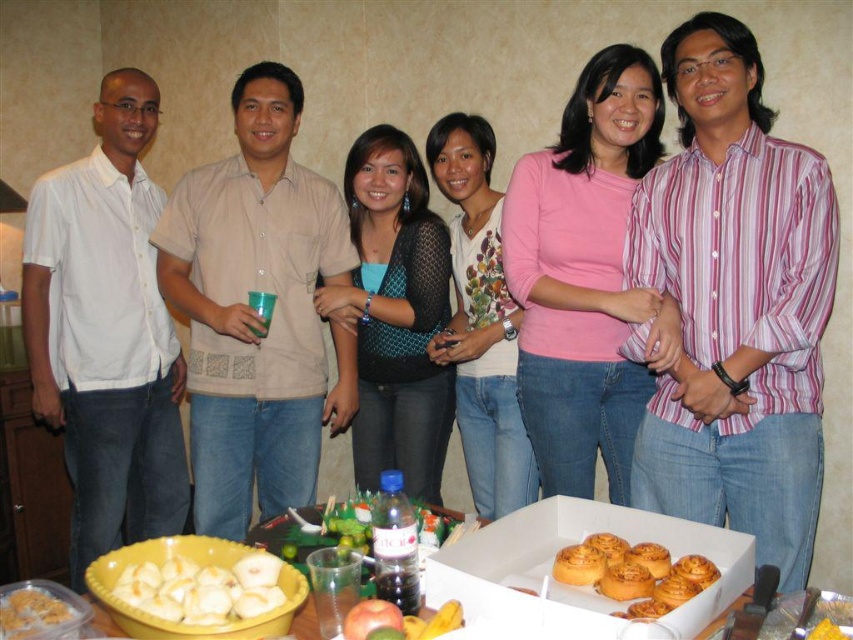
Question: Among these points, which one is farthest from the camera?

Choices:
 (A) (558, 524)
 (B) (693, 566)
 (C) (500, 490)
 (D) (372, 332)

Answer: (D)

Question: Is yellow matte cake at lower left to the right of yellow cake at center from the viewer's perspective?

Choices:
 (A) no
 (B) yes

Answer: (A)

Question: Which is nearer to the teal mesh top at center?

Choices:
 (A) yellow plastic bowl at lower left
 (B) floral print shirt at center
 (C) golden brown doughnut at lower center
 (D) white cardboard box at lower center

Answer: (B)

Question: Considering the relative positions of teal mesh top at center and golden brown doughnut at lower center in the image provided, where is teal mesh top at center located with respect to golden brown doughnut at lower center?

Choices:
 (A) below
 (B) above

Answer: (B)

Question: Does pink matte shirt at center have a lesser width compared to floral print shirt at center?

Choices:
 (A) yes
 (B) no

Answer: (B)

Question: Among these points, which one is nearest to the camera?

Choices:
 (A) (607, 618)
 (B) (630, 467)

Answer: (A)